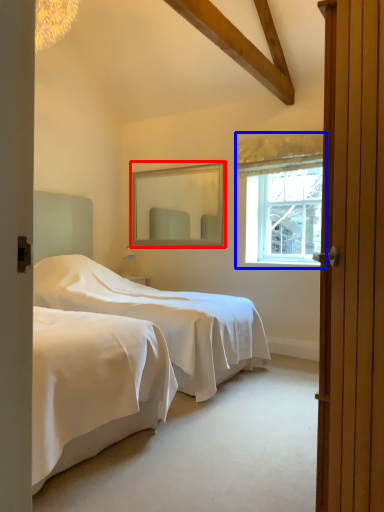
Question: Which point is further to the camera, mirror (highlighted by a red box) or window (highlighted by a blue box)?

Choices:
 (A) mirror
 (B) window

Answer: (A)